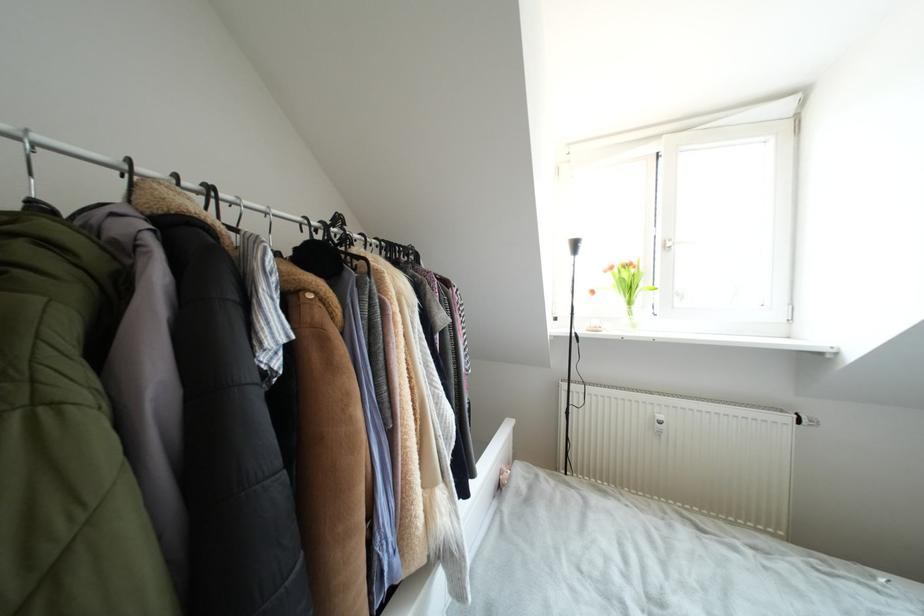
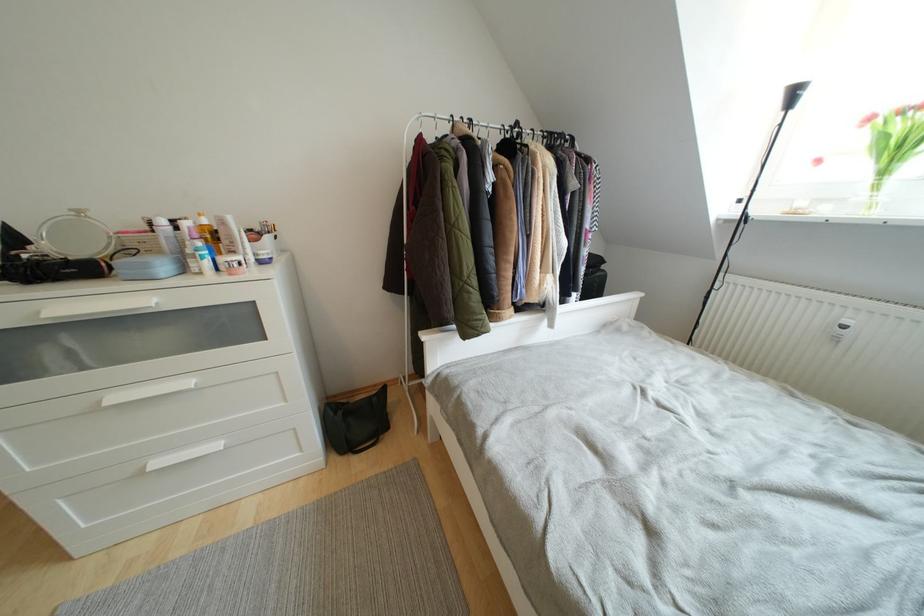
The point at (635, 307) is marked in the first image. Where is the corresponding point in the second image?

(890, 176)